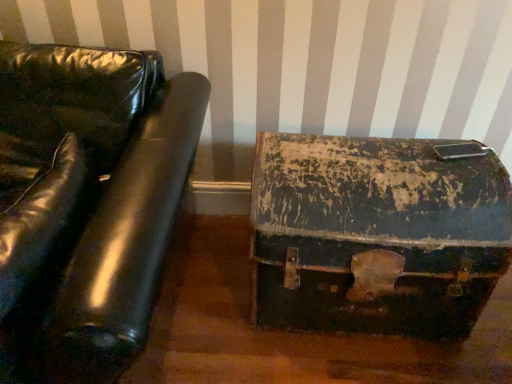
Locate an element on the screen. This screenshot has width=512, height=384. rusty leather suitcase at lower right is located at coordinates (376, 235).

What do you see at coordinates (376, 235) in the screenshot?
I see `rusty leather suitcase at lower right` at bounding box center [376, 235].

In order to face black leather couch at left, should I rotate leftwards or rightwards?

To align with it, rotate left about 29.220°.

What do you see at coordinates (87, 204) in the screenshot? The width and height of the screenshot is (512, 384). I see `black leather couch at left` at bounding box center [87, 204].

You are a GUI agent. You are given a task and a screenshot of the screen. Output one action in this format:
    pyautogui.click(x=<x>, y=<y>)
    Task: Click on the black leather couch at left
    This screenshot has height=384, width=512.
    Given the screenshot: What is the action you would take?
    pyautogui.click(x=87, y=204)

You are a GUI agent. You are given a task and a screenshot of the screen. Output one action in this format:
    pyautogui.click(x=<x>, y=<y>)
    Task: Click on the rusty leather suitcase at lower right
    Image resolution: width=512 pixels, height=384 pixels.
    Given the screenshot: What is the action you would take?
    pyautogui.click(x=376, y=235)

In the scene shown: Considering the positions of objects rusty leather suitcase at lower right and black leather couch at left in the image provided, who is more to the right, rusty leather suitcase at lower right or black leather couch at left?

rusty leather suitcase at lower right is more to the right.

Does rusty leather suitcase at lower right lie behind black leather couch at left?

Yes, it is behind black leather couch at left.

Is point (405, 199) closer or farther from the camera than point (87, 191)?

Point (405, 199) appears to be farther away from the viewer than point (87, 191).

From the image's perspective, is rusty leather suitcase at lower right above or below black leather couch at left?

rusty leather suitcase at lower right is situated lower than black leather couch at left in the image.

From a real-world perspective, is rusty leather suitcase at lower right positioned over black leather couch at left based on gravity?

No, from a real-world perspective, rusty leather suitcase at lower right is not above black leather couch at left.

Considering the relative sizes of rusty leather suitcase at lower right and black leather couch at left in the image provided, is rusty leather suitcase at lower right thinner than black leather couch at left?

Yes, rusty leather suitcase at lower right is thinner than black leather couch at left.

Which of these two, rusty leather suitcase at lower right or black leather couch at left, stands taller?

Standing taller between the two is black leather couch at left.

Based on their sizes in the image, would you say rusty leather suitcase at lower right is bigger or smaller than black leather couch at left?

rusty leather suitcase at lower right is smaller than black leather couch at left.

Is rusty leather suitcase at lower right situated inside black leather couch at left or outside?

rusty leather suitcase at lower right is located beyond the bounds of black leather couch at left.

Is rusty leather suitcase at lower right not near black leather couch at left?

Actually, rusty leather suitcase at lower right and black leather couch at left are a little close together.

Is rusty leather suitcase at lower right positioned with its back to black leather couch at left?

rusty leather suitcase at lower right is not turned away from black leather couch at left.

How different are the orientations of rusty leather suitcase at lower right and black leather couch at left in degrees?

rusty leather suitcase at lower right and black leather couch at left are facing 1.64 degrees away from each other.

This screenshot has width=512, height=384. In order to click on suitcase behind the black leather couch at left in this screenshot , I will do `click(376, 235)`.

Which is more to the left, black leather couch at left or rusty leather suitcase at lower right?

From the viewer's perspective, black leather couch at left appears more on the left side.

Considering the relative positions of black leather couch at left and rusty leather suitcase at lower right in the image provided, is black leather couch at left in front of rusty leather suitcase at lower right?

Yes.

Which is behind, point (148, 313) or point (495, 211)?

Positioned behind is point (495, 211).

From the image's perspective, is black leather couch at left above rusty leather suitcase at lower right?

Yes, from the image's perspective, black leather couch at left is above rusty leather suitcase at lower right.

Based on the photo, from a real-world perspective, is black leather couch at left over rusty leather suitcase at lower right?

Correct, in the physical world, black leather couch at left is higher than rusty leather suitcase at lower right.

Looking at their sizes, would you say black leather couch at left is wider or thinner than rusty leather suitcase at lower right?

Clearly, black leather couch at left has more width compared to rusty leather suitcase at lower right.

In terms of height, does black leather couch at left look taller or shorter compared to rusty leather suitcase at lower right?

Considering their sizes, black leather couch at left has more height than rusty leather suitcase at lower right.

Can you confirm if black leather couch at left is smaller than rusty leather suitcase at lower right?

No.

Is black leather couch at left surrounding rusty leather suitcase at lower right?

That's incorrect, rusty leather suitcase at lower right is not inside black leather couch at left.

Is black leather couch at left not near rusty leather suitcase at lower right?

No, black leather couch at left is not far away from rusty leather suitcase at lower right.

Could you tell me if black leather couch at left is facing rusty leather suitcase at lower right?

No, black leather couch at left is not turned towards rusty leather suitcase at lower right.

How many degrees apart are the facing directions of black leather couch at left and rusty leather suitcase at lower right?

The facing directions of black leather couch at left and rusty leather suitcase at lower right are 1.64 degrees apart.

Locate an element on the screen. This screenshot has height=384, width=512. suitcase below the black leather couch at left (from the image's perspective) is located at coordinates (376, 235).

Locate an element on the screen. The image size is (512, 384). furniture above the rusty leather suitcase at lower right (from the image's perspective) is located at coordinates (87, 204).

In the image, there is a black leather couch at left. Where is `suitcase below it (from a real-world perspective)`? suitcase below it (from a real-world perspective) is located at coordinates (376, 235).